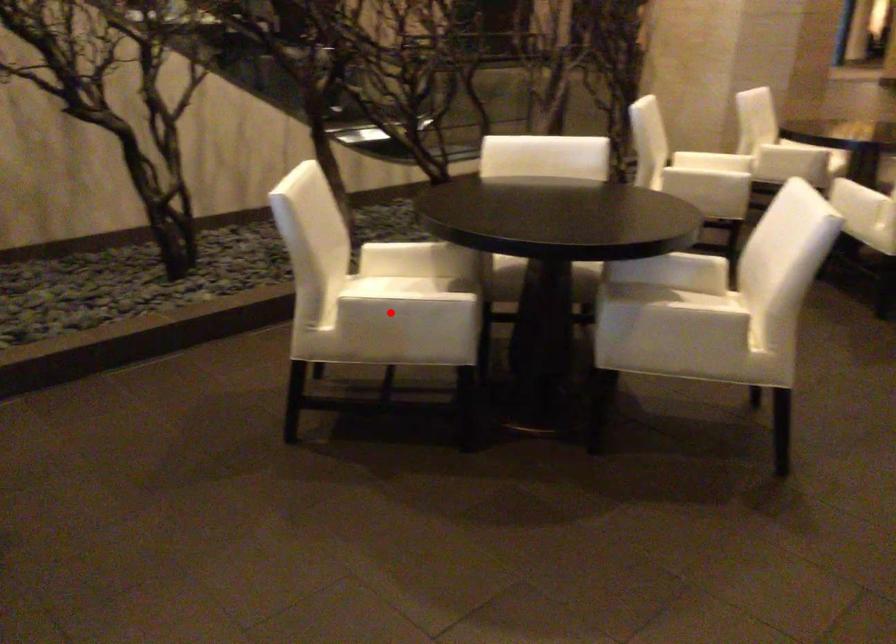
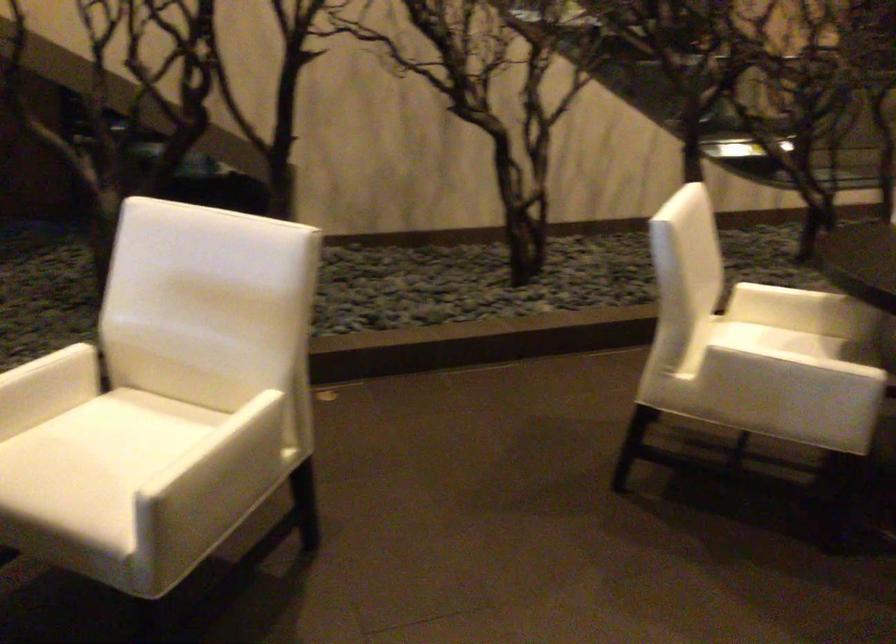
Question: I am providing you with two images of the same scene from different viewpoints. Given a red point in image1, look at the same physical point in image2. Is it:

Choices:
 (A) Closer to the viewpoint
 (B) Farther from the viewpoint

Answer: (A)